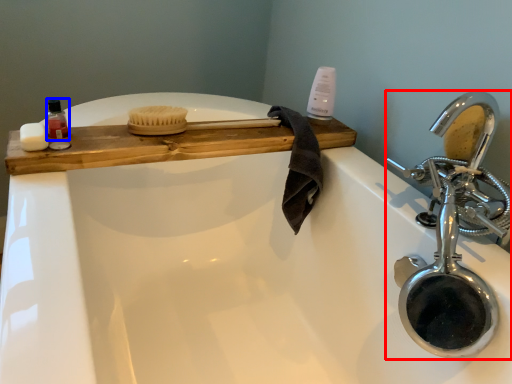
Question: Which object appears closest to the camera in this image, tap (highlighted by a red box) or mouthwash (highlighted by a blue box)?

Choices:
 (A) tap
 (B) mouthwash

Answer: (A)